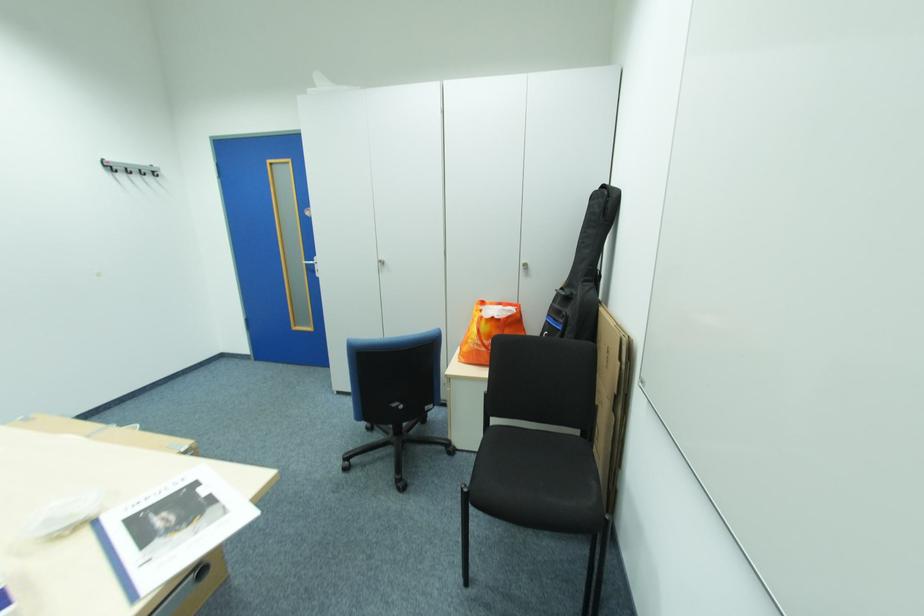
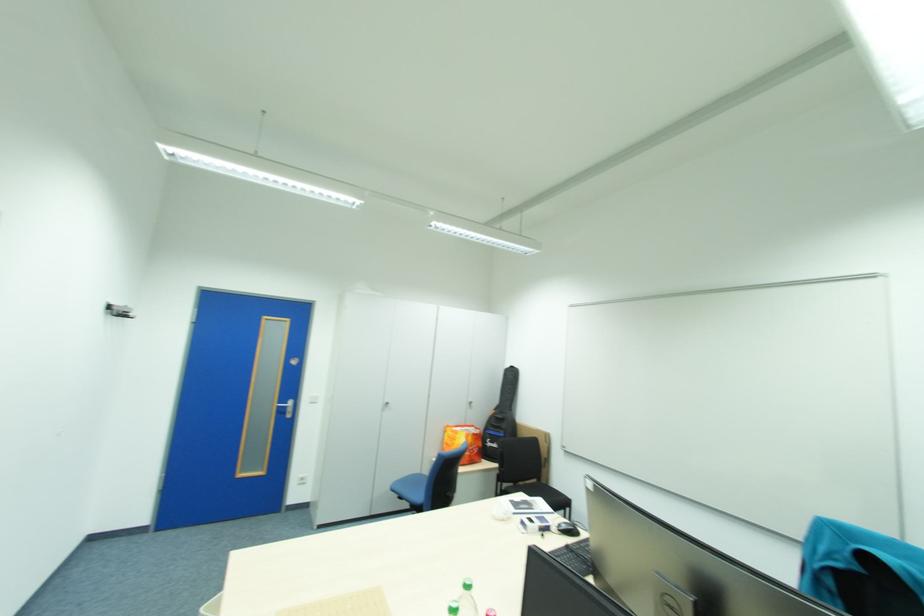
Where in the second image is the point corresponding to the point at 314,265 from the first image?

(286, 407)